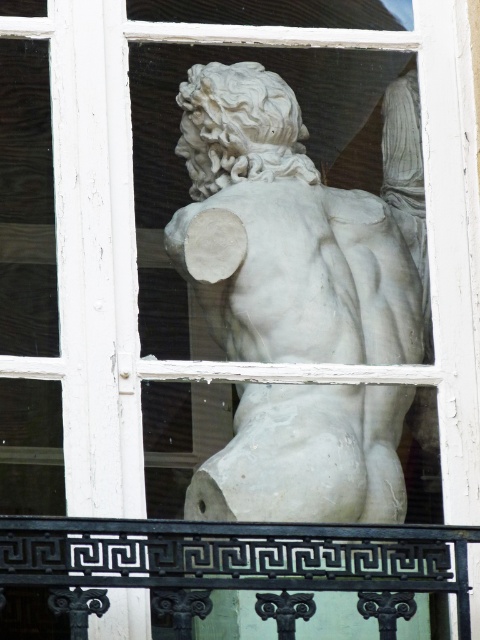
Question: Can you confirm if white marble torso at center is smaller than black wrought iron at lower center?

Choices:
 (A) yes
 (B) no

Answer: (B)

Question: Which point is farther from the camera taking this photo?

Choices:
 (A) (340, 460)
 (B) (259, 582)

Answer: (A)

Question: Does white marble torso at center appear on the left side of black wrought iron at lower center?

Choices:
 (A) no
 (B) yes

Answer: (A)

Question: Does white marble torso at center have a lesser width compared to black wrought iron at lower center?

Choices:
 (A) no
 (B) yes

Answer: (B)